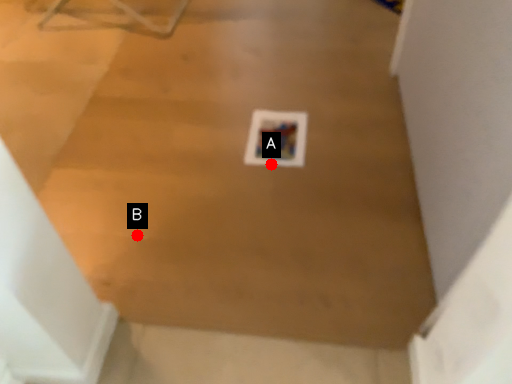
Question: Two points are circled on the image, labeled by A and B beside each circle. Which of the following is the closest to the observer?

Choices:
 (A) A is closer
 (B) B is closer

Answer: (B)